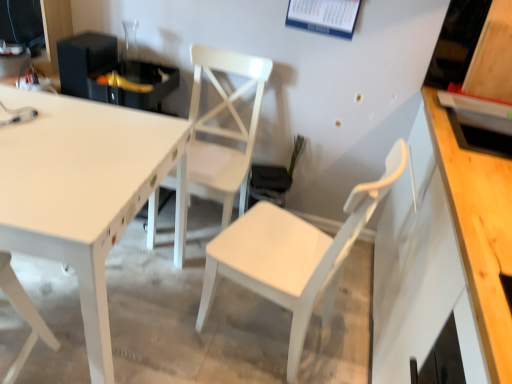
Where is `free space underneath white matte chair at center, which ranks as the first chair in right-to-left order (from a real-world perspective)`? Image resolution: width=512 pixels, height=384 pixels. free space underneath white matte chair at center, which ranks as the first chair in right-to-left order (from a real-world perspective) is located at coordinates (263, 324).